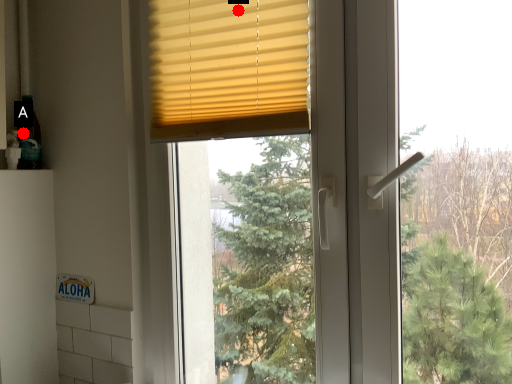
Question: Two points are circled on the image, labeled by A and B beside each circle. Which of the following is the farthest from the observer?

Choices:
 (A) A is further
 (B) B is further

Answer: (A)